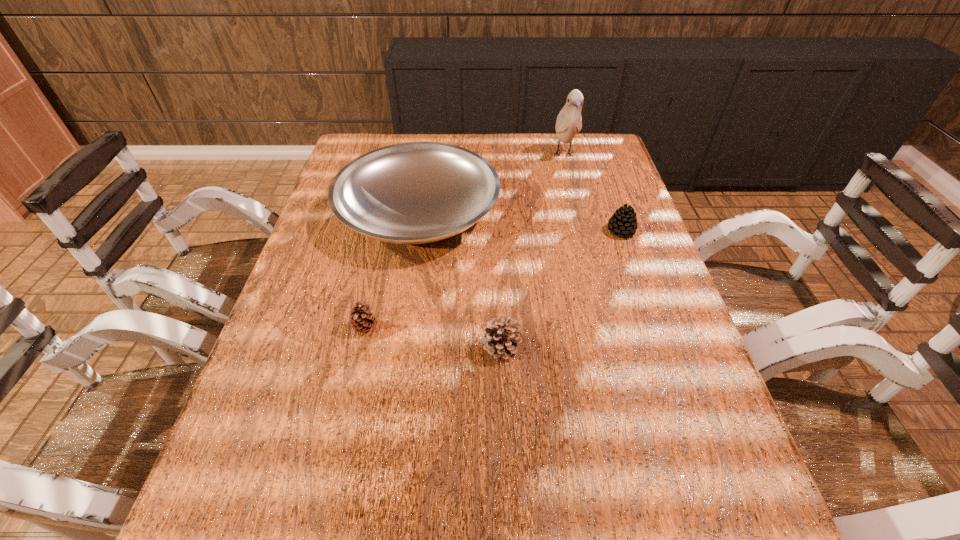
Where is `bird`? bird is located at coordinates (569, 121).

Where is `the tallest object`? Image resolution: width=960 pixels, height=540 pixels. the tallest object is located at coordinates (569, 121).

At what (x,y) coordinates should I click in order to perform the action: click on bedpan. Please return your answer as a coordinate pair (x, y). The width and height of the screenshot is (960, 540). Looking at the image, I should click on (416, 192).

This screenshot has width=960, height=540. Find the location of `the second pinecone from left to right`. the second pinecone from left to right is located at coordinates (500, 340).

Where is `the rightmost object`? The height and width of the screenshot is (540, 960). the rightmost object is located at coordinates (623, 222).

Identify the location of the rightmost pinecone. This screenshot has height=540, width=960. pyautogui.click(x=623, y=222).

The height and width of the screenshot is (540, 960). I want to click on the leftmost pinecone, so click(x=362, y=320).

What are the coordinates of `vacant space located at the beak of the bird` in the screenshot? It's located at (574, 193).

Locate an element on the screen. free spot located 0.300m on the right of the bedpan is located at coordinates (604, 212).

The width and height of the screenshot is (960, 540). What are the coordinates of `vacant space located 0.230m on the left of the second pinecone from left to right` in the screenshot? It's located at (373, 346).